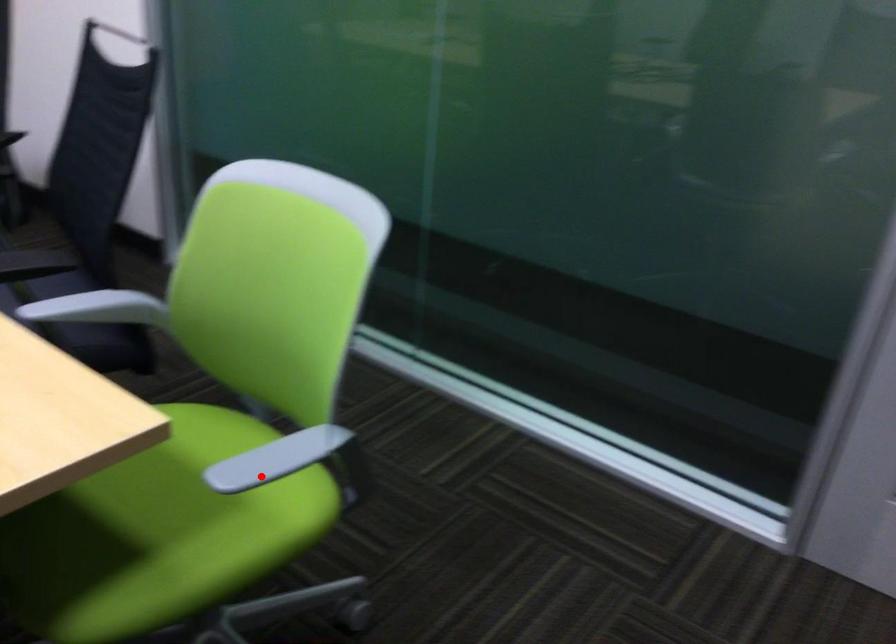
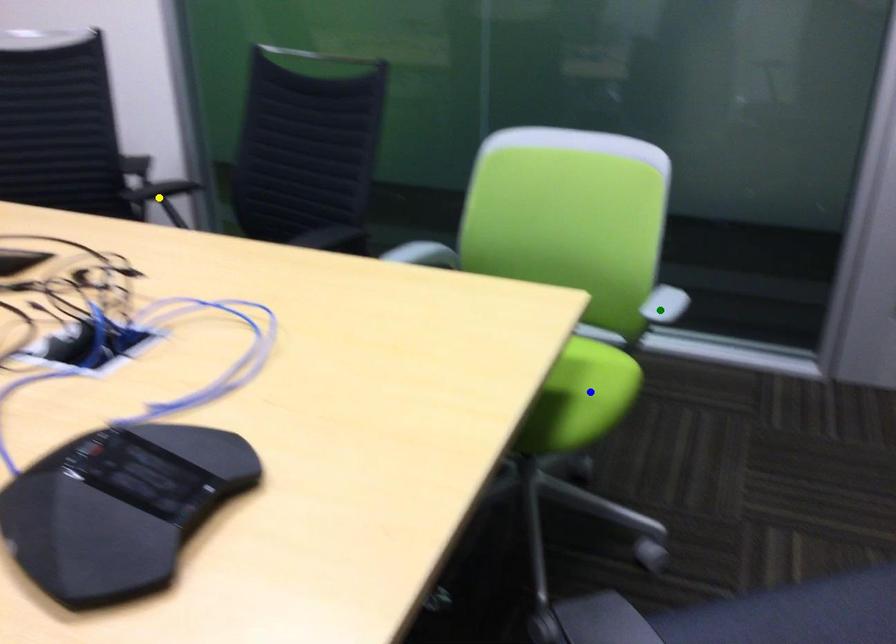
Question: I am providing you with two images of the same scene from different viewpoints. A red point is marked on the first image. You are given multiple points on the second image. Which spot in image 2 lines up with the point in image 1?

Choices:
 (A) blue point
 (B) yellow point
 (C) green point

Answer: (C)